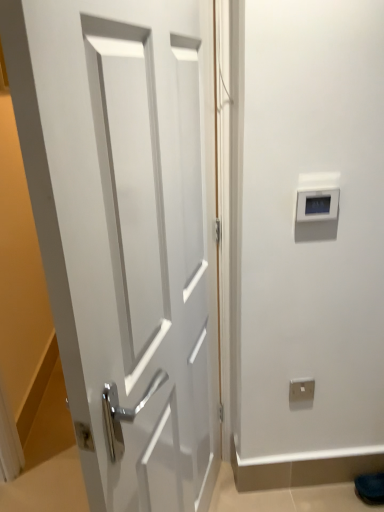
This screenshot has height=512, width=384. What are the coordinates of `gray plastic thermostat at upper right` in the screenshot? It's located at (317, 205).

Describe the element at coordinates (125, 232) in the screenshot. Image resolution: width=384 pixels, height=512 pixels. I see `white glossy door at center` at that location.

The width and height of the screenshot is (384, 512). In order to click on gray plastic thermostat at upper right in this screenshot , I will do `click(317, 205)`.

Consider the image. From a real-world perspective, is gray plastic thermostat at upper right positioned under white plastic electric outlet at lower center based on gravity?

Incorrect, from a real-world perspective, gray plastic thermostat at upper right is higher than white plastic electric outlet at lower center.

Is point (310, 199) farther from viewer compared to point (291, 400)?

No, it is not.

Considering the relative sizes of gray plastic thermostat at upper right and white plastic electric outlet at lower center in the image provided, is gray plastic thermostat at upper right wider than white plastic electric outlet at lower center?

Yes.

How many degrees apart are the facing directions of white plastic electric outlet at lower center and white glossy door at center?

The angle between the facing direction of white plastic electric outlet at lower center and the facing direction of white glossy door at center is 110 degrees.

Is white plastic electric outlet at lower center next to white glossy door at center and touching it?

white plastic electric outlet at lower center and white glossy door at center are clearly separated.

From a real-world perspective, between white plastic electric outlet at lower center and white glossy door at center, who is vertically higher?

In real-world perspective, white glossy door at center is above.

Considering the relative sizes of white plastic electric outlet at lower center and white glossy door at center in the image provided, is white plastic electric outlet at lower center thinner than white glossy door at center?

Correct, the width of white plastic electric outlet at lower center is less than that of white glossy door at center.

Does white plastic electric outlet at lower center turn towards gray plastic thermostat at upper right?

No, white plastic electric outlet at lower center is not oriented towards gray plastic thermostat at upper right.

Which object is positioned more to the right, white plastic electric outlet at lower center or gray plastic thermostat at upper right?

Positioned to the right is white plastic electric outlet at lower center.

From the image's perspective, is white plastic electric outlet at lower center above gray plastic thermostat at upper right?

Actually, white plastic electric outlet at lower center appears below gray plastic thermostat at upper right in the image.

Which is more to the left, gray plastic thermostat at upper right or white glossy door at center?

white glossy door at center.

Would you say white glossy door at center is part of gray plastic thermostat at upper right's contents?

No, gray plastic thermostat at upper right does not contain white glossy door at center.

Is gray plastic thermostat at upper right thinner than white glossy door at center?

Yes, gray plastic thermostat at upper right is thinner than white glossy door at center.

Are gray plastic thermostat at upper right and white glossy door at center far apart?

That's not correct — gray plastic thermostat at upper right is a little close to white glossy door at center.

Can you confirm if white glossy door at center is bigger than white plastic electric outlet at lower center?

Yes.

Would you say white glossy door at center contains white plastic electric outlet at lower center?

That's incorrect, white plastic electric outlet at lower center is not inside white glossy door at center.

Could you tell me if white glossy door at center is turned towards white plastic electric outlet at lower center?

No, white glossy door at center is not facing towards white plastic electric outlet at lower center.

From a real-world perspective, does white glossy door at center sit lower than white plastic electric outlet at lower center?

No.

Does white glossy door at center have a smaller size compared to gray plastic thermostat at upper right?

Incorrect, white glossy door at center is not smaller in size than gray plastic thermostat at upper right.

Is white glossy door at center in contact with gray plastic thermostat at upper right?

No, white glossy door at center is not beside gray plastic thermostat at upper right.

Locate an element on the screen. door that appears on the left of gray plastic thermostat at upper right is located at coordinates pyautogui.click(x=125, y=232).

There is a white plastic electric outlet at lower center. Where is `thermostat above it (from a real-world perspective)`? This screenshot has width=384, height=512. thermostat above it (from a real-world perspective) is located at coordinates (317, 205).

This screenshot has height=512, width=384. Identify the location of electric outlet below the white glossy door at center (from the image's perspective). (301, 389).

Based on their spatial positions, is white glossy door at center or white plastic electric outlet at lower center closer to gray plastic thermostat at upper right?

white glossy door at center is positioned closer to the anchor gray plastic thermostat at upper right.

Estimate the real-world distances between objects in this image. Which object is closer to white plastic electric outlet at lower center, gray plastic thermostat at upper right or white glossy door at center?

Based on the image, gray plastic thermostat at upper right appears to be nearer to white plastic electric outlet at lower center.

When comparing their distances from white plastic electric outlet at lower center, does white glossy door at center or gray plastic thermostat at upper right seem closer?

gray plastic thermostat at upper right is closer to white plastic electric outlet at lower center.

Looking at the image, which one is located further to white glossy door at center, gray plastic thermostat at upper right or white plastic electric outlet at lower center?

white plastic electric outlet at lower center is positioned further to the anchor white glossy door at center.

Considering their positions, is white plastic electric outlet at lower center positioned further to white glossy door at center than gray plastic thermostat at upper right?

Based on the image, white plastic electric outlet at lower center appears to be further to white glossy door at center.

Looking at the image, which one is located closer to gray plastic thermostat at upper right, white plastic electric outlet at lower center or white glossy door at center?

white glossy door at center lies closer to gray plastic thermostat at upper right than the other object.

Find the location of a particular element. The width and height of the screenshot is (384, 512). thermostat between white glossy door at center and white plastic electric outlet at lower center from front to back is located at coordinates (317, 205).